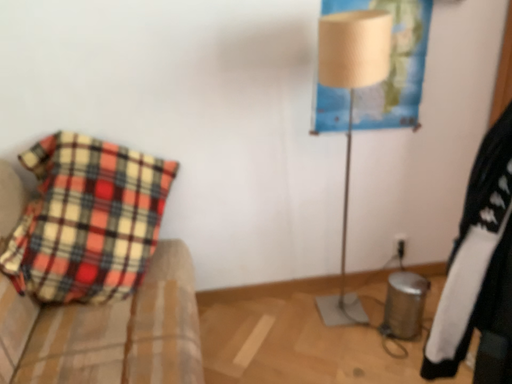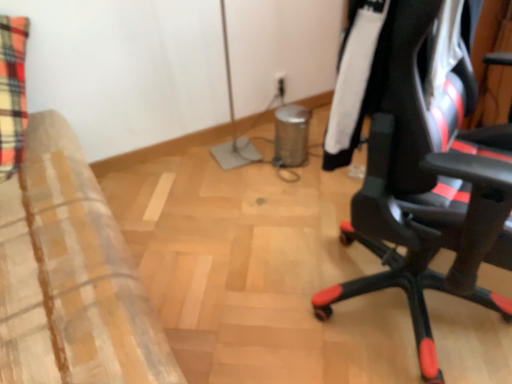
Question: How did the camera likely rotate when shooting the video?

Choices:
 (A) rotated downward
 (B) rotated upward

Answer: (A)